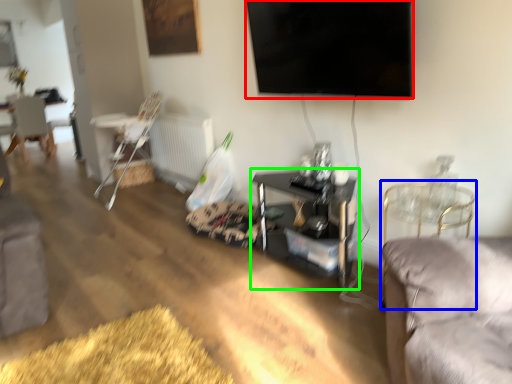
Question: Which object is the farthest from television (highlighted by a red box)? Choose among these: chair (highlighted by a blue box) or table (highlighted by a green box).

Choices:
 (A) chair
 (B) table

Answer: (B)